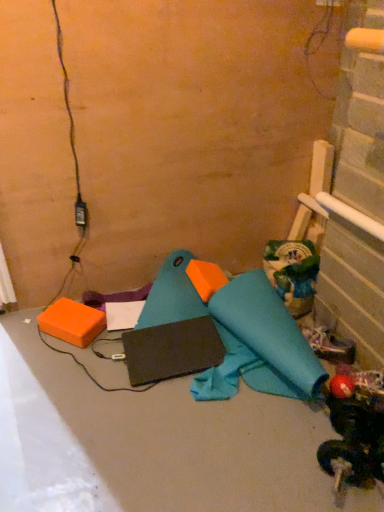
This screenshot has height=512, width=384. Find the location of `matte black laptop at center`. matte black laptop at center is located at coordinates tap(151, 443).

What do you see at coordinates (329, 345) in the screenshot?
I see `white fabric shoe at lower right` at bounding box center [329, 345].

The image size is (384, 512). What do you see at coordinates (355, 429) in the screenshot? I see `rubberized red ball at lower right, acting as the first toy starting from the front` at bounding box center [355, 429].

Identify the location of matte black laptop at center. The width and height of the screenshot is (384, 512). coord(151,443).

Considering the sizes of orange foam block at lower left and green matte bag at upper right, which is the second toy from bottom to top, in the image, is orange foam block at lower left taller or shorter than green matte bag at upper right, which is the second toy from bottom to top,?

In the image, orange foam block at lower left appears to be shorter than green matte bag at upper right, which is the second toy from bottom to top.

Can you confirm if orange foam block at lower left is bigger than green matte bag at upper right, which is the second toy from bottom to top?

Actually, orange foam block at lower left might be smaller than green matte bag at upper right, which is the second toy from bottom to top.

Does point (65, 302) come farther from viewer compared to point (306, 269)?

No, it is in front of (306, 269).

From the image's perspective, does orange foam block at lower left appear lower than green matte bag at upper right, the 1th toy from the top?

Yes, from the image's perspective, orange foam block at lower left is below green matte bag at upper right, the 1th toy from the top.

Can we say orange foam block at lower left lies outside white fabric shoe at lower right?

orange foam block at lower left lies outside white fabric shoe at lower right's area.

Is orange foam block at lower left taller than white fabric shoe at lower right?

Incorrect, the height of orange foam block at lower left is not larger of that of white fabric shoe at lower right.

Based on the photo, how far apart are orange foam block at lower left and white fabric shoe at lower right?

orange foam block at lower left and white fabric shoe at lower right are 34.92 inches apart from each other.

Where is `box that is above the white fabric shoe at lower right (from the image's perspective)`? The width and height of the screenshot is (384, 512). box that is above the white fabric shoe at lower right (from the image's perspective) is located at coordinates click(72, 322).

How far apart are orange foam block at lower left and black matte laptop at center?

orange foam block at lower left is 28.86 centimeters from black matte laptop at center.

From the image's perspective, between orange foam block at lower left and black matte laptop at center, who is located below?

black matte laptop at center is shown below in the image.

How many degrees apart are the facing directions of orange foam block at lower left and black matte laptop at center?

The facing directions of orange foam block at lower left and black matte laptop at center are 50.1 degrees apart.

Which is in front, point (72, 308) or point (139, 340)?

Point (139, 340)

Is rubberized red ball at lower right, which is the 2th toy in top-to-bottom order, not close to black matte laptop at center?

No, there isn't a large distance between rubberized red ball at lower right, which is the 2th toy in top-to-bottom order, and black matte laptop at center.

Which is correct: rubberized red ball at lower right, which is the second toy from back to front, is inside black matte laptop at center, or outside of it?

rubberized red ball at lower right, which is the second toy from back to front, is not inside black matte laptop at center, it's outside.

Could you tell me if rubberized red ball at lower right, which appears as the first toy when ordered from the bottom, is facing black matte laptop at center?

Yes, rubberized red ball at lower right, which appears as the first toy when ordered from the bottom, is aimed at black matte laptop at center.

How different are the orientations of rubberized red ball at lower right, which is the 2th toy in top-to-bottom order, and black matte laptop at center in degrees?

They differ by 37.5 degrees in their facing directions.

Find the location of a particular element. footwear below the green matte bag at upper right, the 1th toy from the top (from a real-world perspective) is located at coordinates (329, 345).

How many degrees apart are the facing directions of green matte bag at upper right, which is the second toy from bottom to top, and white fabric shoe at lower right?

62.7 degrees separate the facing orientations of green matte bag at upper right, which is the second toy from bottom to top, and white fabric shoe at lower right.

Between green matte bag at upper right, which is counted as the second toy, starting from the front, and white fabric shoe at lower right, which one has smaller size?

Smaller between the two is white fabric shoe at lower right.

Is orange foam block at lower left looking in the opposite direction of rubberized red ball at lower right, which appears as the first toy when ordered from the bottom?

No.

Is point (85, 306) farther from viewer compared to point (351, 413)?

Yes, point (85, 306) is farther from viewer.

Could you measure the distance between orange foam block at lower left and rubberized red ball at lower right, which is the second toy from back to front?

They are 38.16 inches apart.

From the image's perspective, which is below, matte black laptop at center or orange foam block at lower left?

matte black laptop at center, from the image's perspective.

From a real-world perspective, is matte black laptop at center positioned above or below orange foam block at lower left?

From a real-world perspective, matte black laptop at center is physically below orange foam block at lower left.

Is matte black laptop at center closer to the viewer compared to orange foam block at lower left?

Yes, the depth of matte black laptop at center is less than that of orange foam block at lower left.

Find the location of a particular element. This screenshot has width=384, height=512. box directly beneath the green matte bag at upper right, which is counted as the second toy, starting from the front (from a real-world perspective) is located at coordinates (72, 322).

You are a GUI agent. You are given a task and a screenshot of the screen. Output one action in this format:
    pyautogui.click(x=<x>, y=<y>)
    Task: Click on the footwear in front of the orange foam block at lower left
    The image size is (384, 512).
    Given the screenshot: What is the action you would take?
    pyautogui.click(x=329, y=345)

Looking at the image, which one is located further to orange foam block at lower left, rubberized red ball at lower right, which is the 2th toy in top-to-bottom order, or white fabric shoe at lower right?

rubberized red ball at lower right, which is the 2th toy in top-to-bottom order, is positioned further to the anchor orange foam block at lower left.

In the scene shown: Based on their spatial positions, is matte black laptop at center or black matte laptop at center further from rubberized red ball at lower right, which appears as the first toy when ordered from the bottom?

Based on the image, black matte laptop at center appears to be further to rubberized red ball at lower right, which appears as the first toy when ordered from the bottom.

From the image, which object appears to be farther from white fabric shoe at lower right, black matte laptop at center or green matte bag at upper right, the 1th toy from the top?

black matte laptop at center is further to white fabric shoe at lower right.

When comparing their distances from rubberized red ball at lower right, which is the second toy from back to front, does orange foam block at lower left or white fabric shoe at lower right seem further?

orange foam block at lower left.

Which object lies further to the anchor point orange foam block at lower left, green matte bag at upper right, which ranks as the 1th toy in back-to-front order, or rubberized red ball at lower right, acting as the first toy starting from the front?

The object further to orange foam block at lower left is rubberized red ball at lower right, acting as the first toy starting from the front.

Looking at the image, which one is located further to matte black laptop at center, black matte laptop at center or orange foam block at lower left?

orange foam block at lower left is positioned further to the anchor matte black laptop at center.

Based on their spatial positions, is matte black laptop at center or green matte bag at upper right, which is counted as the second toy, starting from the front, closer to white fabric shoe at lower right?

green matte bag at upper right, which is counted as the second toy, starting from the front, is closer to white fabric shoe at lower right.

Considering their positions, is green matte bag at upper right, which ranks as the 1th toy in back-to-front order, positioned further to white fabric shoe at lower right than orange foam block at lower left?

The object further to white fabric shoe at lower right is orange foam block at lower left.

At what (x,y) coordinates should I click in order to perform the action: click on concrete between orange foam block at lower left and rubberized red ball at lower right, which is the 2th toy in top-to-bottom order. Please return your answer as a coordinate pair (x, y). The image size is (384, 512). Looking at the image, I should click on (151, 443).

This screenshot has height=512, width=384. In order to click on pad between rubberized red ball at lower right, which is the 2th toy in top-to-bottom order, and green matte bag at upper right, which is the second toy from bottom to top, in the front-back direction in this screenshot , I will do (172, 350).

This screenshot has width=384, height=512. In order to click on pad located between orange foam block at lower left and white fabric shoe at lower right in the left-right direction in this screenshot , I will do `click(172, 350)`.

Identify the location of pad between matte black laptop at center and white fabric shoe at lower right along the z-axis. (172, 350).